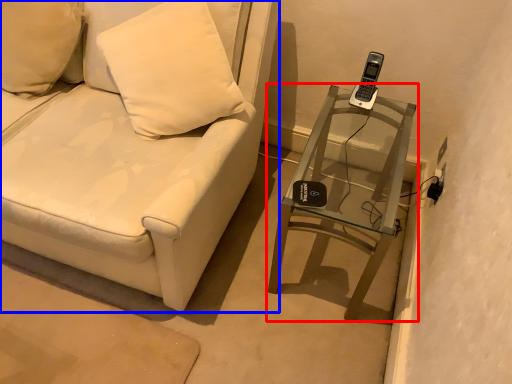
Question: Which of the following is the farthest to the observer, table (highlighted by a red box) or furniture (highlighted by a blue box)?

Choices:
 (A) table
 (B) furniture

Answer: (A)